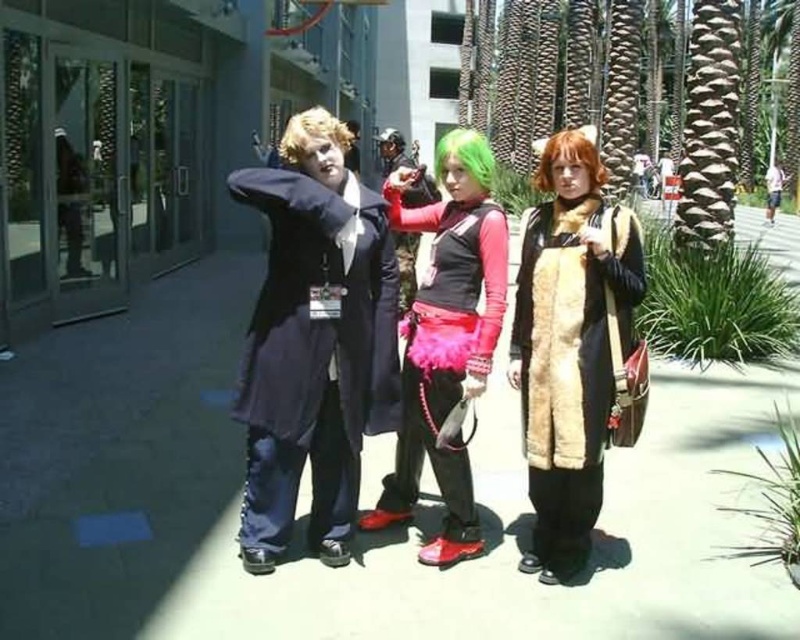
Question: Does velvet pink skirt at center appear on the left side of light brown leather jacket at center?

Choices:
 (A) yes
 (B) no

Answer: (A)

Question: Which of the following is the farthest from the observer?

Choices:
 (A) (494, 243)
 (B) (536, 150)
 (C) (286, 396)
 (D) (528, 221)

Answer: (B)

Question: Is green synthetic wig at center bigger than light brown leather jacket at center?

Choices:
 (A) yes
 (B) no

Answer: (A)

Question: Which of the following is the farthest from the observer?

Choices:
 (A) (772, 188)
 (B) (222, 570)
 (C) (342, 355)
 (D) (468, 518)

Answer: (A)

Question: Among these objects, which one is nearest to the camera?

Choices:
 (A) light brown leather jacket at center
 (B) green synthetic wig at center
 (C) fuzzy brown coat at center

Answer: (C)

Question: Is green synthetic wig at center above light brown leather jacket at center?

Choices:
 (A) no
 (B) yes

Answer: (B)